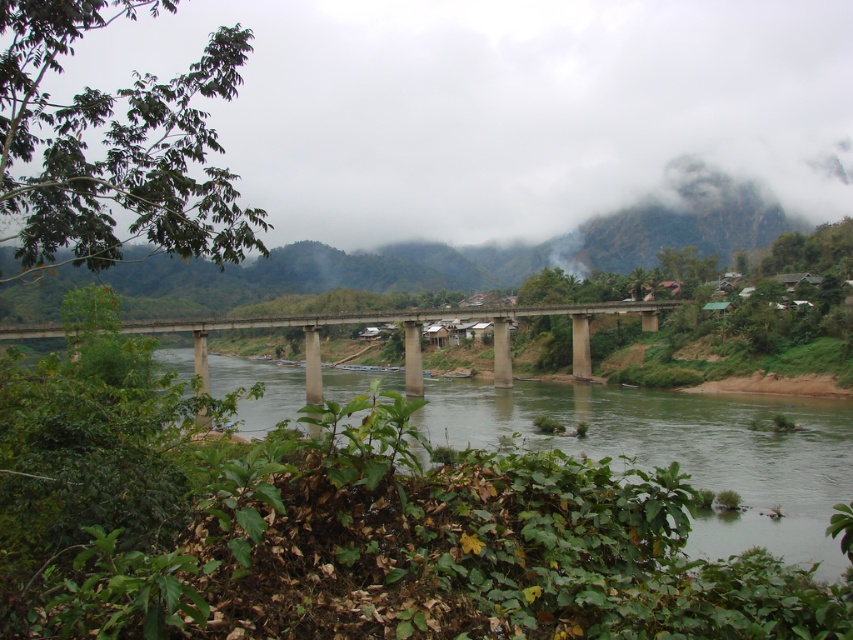
Can you confirm if green grassy river at center is bigger than concrete bridge at center?

Yes, green grassy river at center is bigger than concrete bridge at center.

Measure the distance between point (495, 419) and camera.

They are 91.68 meters apart.

What are the coordinates of `green grassy river at center` in the screenshot? It's located at coord(680,451).

Who is lower down, white fluffy cloud at upper center or green grassy river at center?

→ green grassy river at center is lower down.

Find the location of `white fluffy cloud at upper center`. white fluffy cloud at upper center is located at coordinates pyautogui.click(x=503, y=108).

Looking at this image, can you confirm if white fluffy cloud at upper center is positioned below concrete bridge at center?

Incorrect, white fluffy cloud at upper center is not positioned below concrete bridge at center.

Is white fluffy cloud at upper center taller than concrete bridge at center?

Yes, white fluffy cloud at upper center is taller than concrete bridge at center.

Between point (508, 129) and point (305, 397), which one is positioned behind?

The point (508, 129) is behind.

Where is `white fluffy cloud at upper center`? The width and height of the screenshot is (853, 640). white fluffy cloud at upper center is located at coordinates (503, 108).